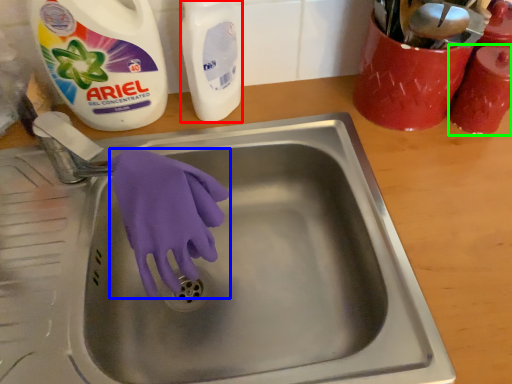
Question: Considering the real-world distances, which object is farthest from cleaning product (highlighted by a red box)? glove (highlighted by a blue box) or cleaning product (highlighted by a green box)?

Choices:
 (A) glove
 (B) cleaning product

Answer: (B)